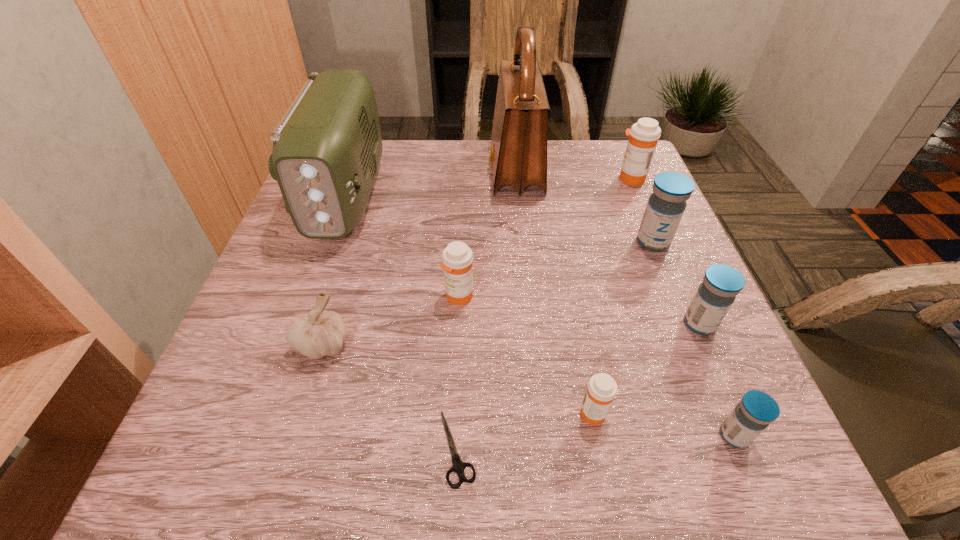
Locate an element on the screen. This screenshot has height=540, width=960. garlic is located at coordinates (323, 332).

Find the location of `the nearest orange medicine`. the nearest orange medicine is located at coordinates (602, 388).

Find the location of a particular element. the smallest orange medicine is located at coordinates (602, 388).

Locate an element on the screen. the smallest blue medicine is located at coordinates (756, 410).

Where is `black shears`? black shears is located at coordinates (459, 466).

Where is `the shortest object`? the shortest object is located at coordinates (459, 466).

Where is `free spot located on the front flap of the shoulder bag`? free spot located on the front flap of the shoulder bag is located at coordinates (364, 170).

Find the location of a particular element. free spot located 0.230m on the front flap of the shoulder bag is located at coordinates (399, 170).

Identify the location of vacant space situated 0.090m on the front flap of the shoulder bag. (454, 170).

The width and height of the screenshot is (960, 540). Find the location of `free location located on the front-facing side of the radio_receiver`. free location located on the front-facing side of the radio_receiver is located at coordinates (317, 276).